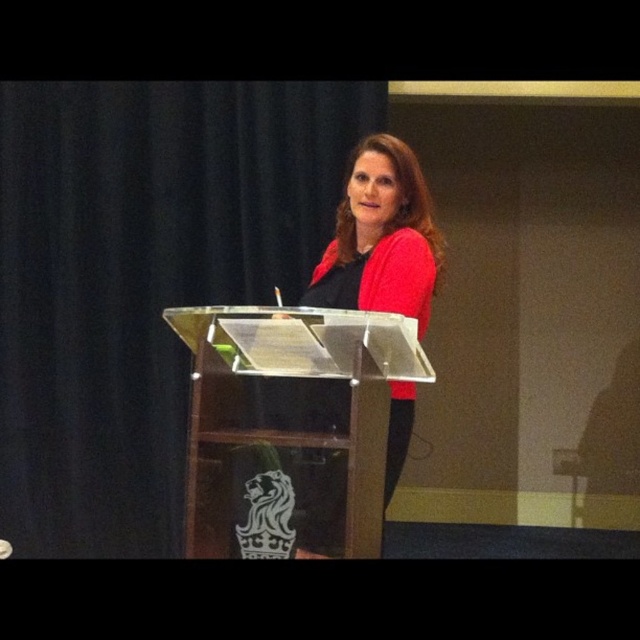
Based on the photo, you are an event organizer setting up a stage for a presentation. You have a clear acrylic podium at center and a matte red sweater at center. If you need to place a large banner behind the podium, which object should you position the banner relative to to ensure it is visible to the audience?

The clear acrylic podium at center is wider than the matte red sweater at center, so positioning the banner behind the podium will ensure it is visible to the audience as the podium has a larger width.

You are an attendee at a conference and want to take a photo of the speaker. The clear acrylic podium at center and the matte red sweater at center are both in your camera frame. Which object will appear larger in your photo?

The clear acrylic podium at center will appear larger in the photo because it is closer to the viewer than the matte red sweater at center.

You are an event planner setting up a stage for a presentation. You need to ensure that the clear acrylic podium at center does not block the view of the matte red sweater at center worn by the speaker. Based on their heights, is this possible?

The clear acrylic podium at center is shorter than the matte red sweater at center, so the podium will not block the view of the speaker wearing the matte red sweater at center.